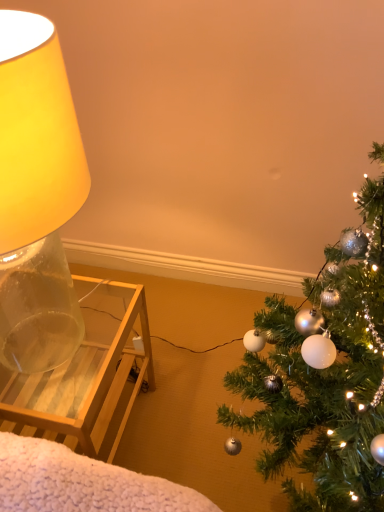
Question: In terms of width, does translucent glass lamp at left look wider or thinner when compared to shiny silver ornaments at right?

Choices:
 (A) wide
 (B) thin

Answer: (B)

Question: From their relative heights in the image, would you say translucent glass lamp at left is taller or shorter than shiny silver ornaments at right?

Choices:
 (A) short
 (B) tall

Answer: (A)

Question: Considering the positions of point (67, 143) and point (269, 411), is point (67, 143) closer or farther from the camera than point (269, 411)?

Choices:
 (A) farther
 (B) closer

Answer: (B)

Question: In terms of height, does shiny silver ornaments at right look taller or shorter compared to translucent glass lamp at left?

Choices:
 (A) short
 (B) tall

Answer: (B)

Question: From a real-world perspective, is shiny silver ornaments at right above or below translucent glass lamp at left?

Choices:
 (A) above
 (B) below

Answer: (B)

Question: Relative to translucent glass lamp at left, is shiny silver ornaments at right in front or behind?

Choices:
 (A) behind
 (B) front

Answer: (B)

Question: Is shiny silver ornaments at right bigger or smaller than translucent glass lamp at left?

Choices:
 (A) small
 (B) big

Answer: (A)